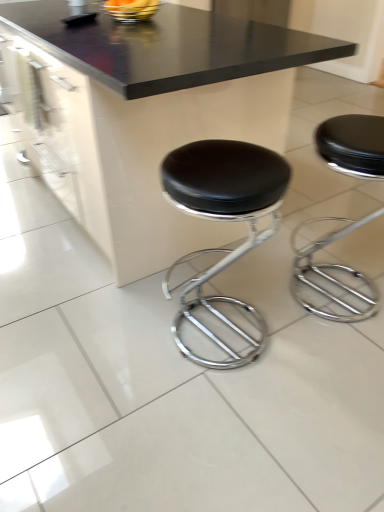
Question: From the image's perspective, is black leather stool at center, the first stool in the left-to-right sequence, positioned above or below metallic silver bowl at upper center?

Choices:
 (A) below
 (B) above

Answer: (A)

Question: Is black leather stool at center, the first stool in the left-to-right sequence, inside or outside of metallic silver bowl at upper center?

Choices:
 (A) outside
 (B) inside

Answer: (A)

Question: Which object is the closest to the black leather stool at center, the first stool in the left-to-right sequence?

Choices:
 (A) black leather stool at center, acting as the first stool starting from the right
 (B) black glossy table at center
 (C) metallic silver bowl at upper center

Answer: (A)

Question: Estimate the real-world distances between objects in this image. Which object is farther from the black leather stool at center, the second stool positioned from the right?

Choices:
 (A) black glossy table at center
 (B) metallic silver bowl at upper center
 (C) black leather stool at center, acting as the first stool starting from the right

Answer: (B)